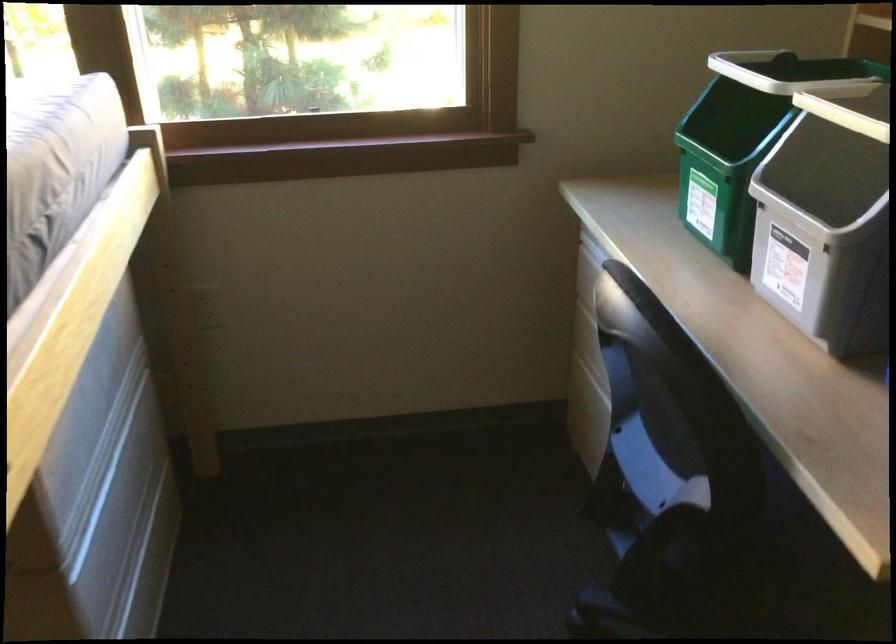
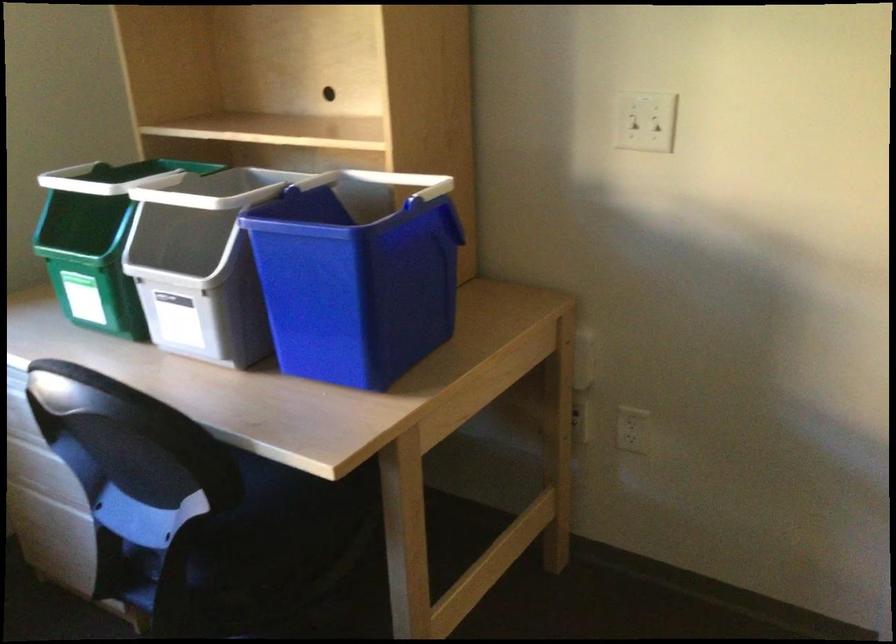
The point at (794, 70) is marked in the first image. Where is the corresponding point in the second image?

(116, 178)